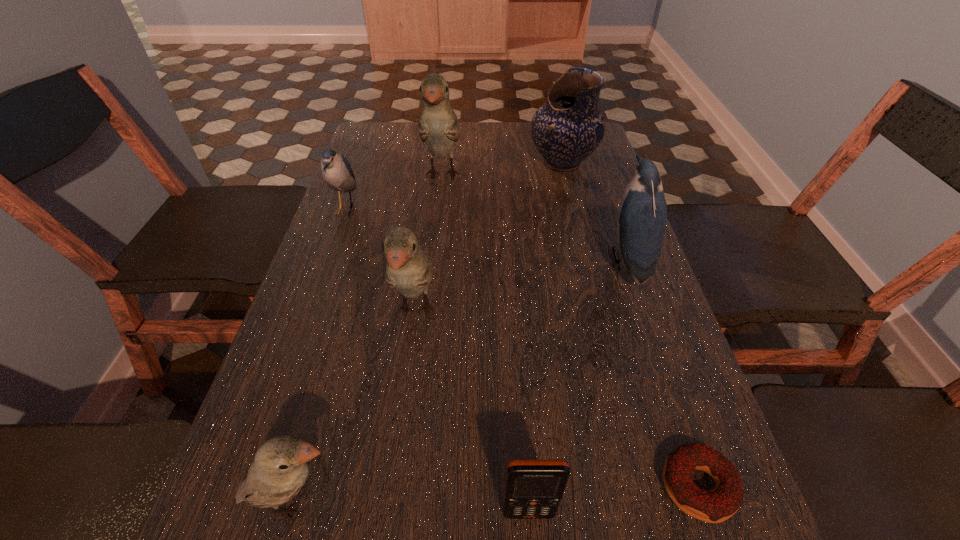
This screenshot has width=960, height=540. What are the coordinates of `the fourth object from right to left` in the screenshot? It's located at (534, 487).

Locate an element on the screen. cellular telephone is located at coordinates (534, 487).

I want to click on chocolate doughnut, so click(717, 505).

The height and width of the screenshot is (540, 960). What are the coordinates of `doughnut` in the screenshot? It's located at (717, 505).

Locate an element on the screen. This screenshot has width=960, height=540. vacant space located at the face of the tallest object is located at coordinates (435, 242).

Identify the location of free location located 0.260m on the front of the pottery. The height and width of the screenshot is (540, 960). (583, 244).

At what (x,y) coordinates should I click in order to perform the action: click on vacant point located 0.120m at the tip of the nearer blue bird's beak. Please return your answer as a coordinate pair (x, y). Looking at the image, I should click on (554, 261).

Identify the location of free region located 0.310m at the tip of the nearer blue bird's beak. [470, 261].

Find the location of `vacant space located 0.160m at the tip of the nearer blue bird's beak`. vacant space located 0.160m at the tip of the nearer blue bird's beak is located at coordinates (537, 261).

Locate an element on the screen. free space located 0.280m at the face of the second smallest white bird is located at coordinates (388, 513).